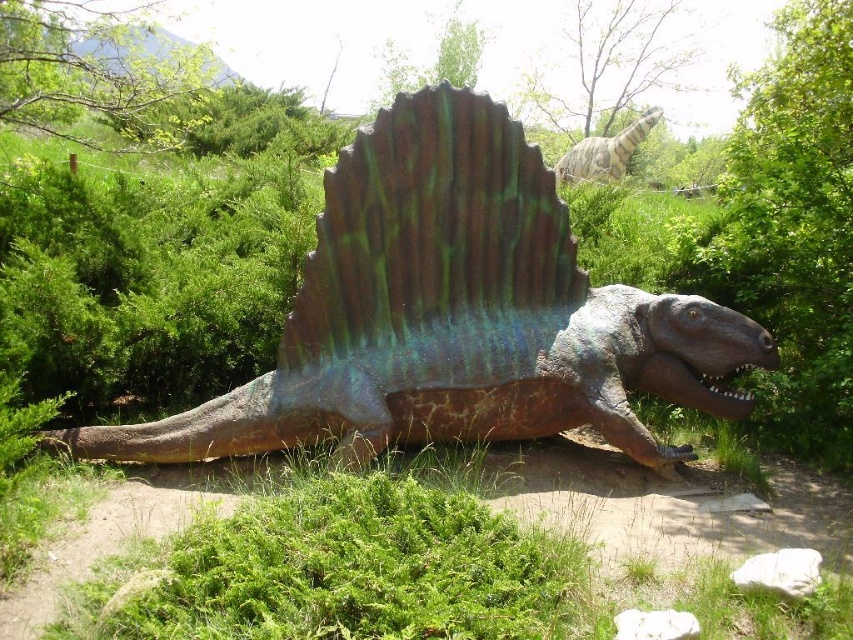
Who is more forward, (549, 307) or (619, 172)?

Point (549, 307) is in front.

What do you see at coordinates (454, 314) in the screenshot? This screenshot has width=853, height=640. I see `shiny metallic dinosaur at center` at bounding box center [454, 314].

You are a GUI agent. You are given a task and a screenshot of the screen. Output one action in this format:
    pyautogui.click(x=<x>, y=<y>)
    Task: Click on the shiny metallic dinosaur at center
    This screenshot has width=853, height=640.
    Given the screenshot: What is the action you would take?
    pyautogui.click(x=454, y=314)

At what (x,y) coordinates should I click in order to perform the action: click on shiny metallic dinosaur at center. Please return your answer as a coordinate pair (x, y). The width and height of the screenshot is (853, 640). Looking at the image, I should click on (454, 314).